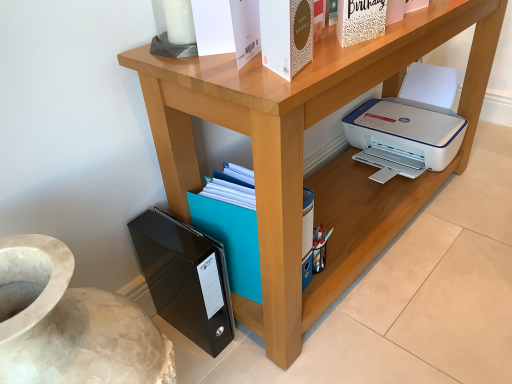
The width and height of the screenshot is (512, 384). Find the location of `free space that is in between wooden printer at lower right and black glossy file folder at lower left, which ranks as the 1th paperback book in back-to-front order`. free space that is in between wooden printer at lower right and black glossy file folder at lower left, which ranks as the 1th paperback book in back-to-front order is located at coordinates (249, 364).